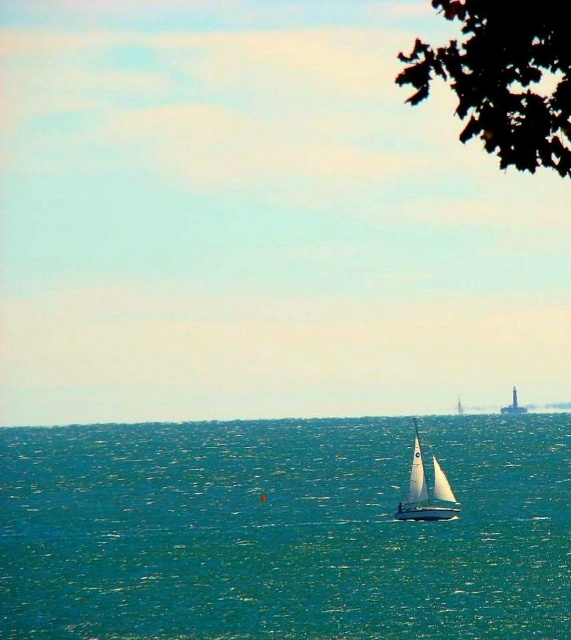
Question: Is teal water at center smaller than white sailboat at center?

Choices:
 (A) no
 (B) yes

Answer: (A)

Question: Which object appears farthest from the camera in this image?

Choices:
 (A) green leafy tree at upper right
 (B) white sailboat at center
 (C) teal water at center

Answer: (B)

Question: Does teal water at center have a greater width compared to white sailboat at center?

Choices:
 (A) yes
 (B) no

Answer: (A)

Question: Based on their relative distances, which object is farther from the teal water at center?

Choices:
 (A) green leafy tree at upper right
 (B) white sailboat at center

Answer: (A)

Question: Estimate the real-world distances between objects in this image. Which object is closer to the green leafy tree at upper right?

Choices:
 (A) white sailboat at center
 (B) teal water at center

Answer: (A)

Question: Is teal water at center to the left of green leafy tree at upper right from the viewer's perspective?

Choices:
 (A) no
 (B) yes

Answer: (B)